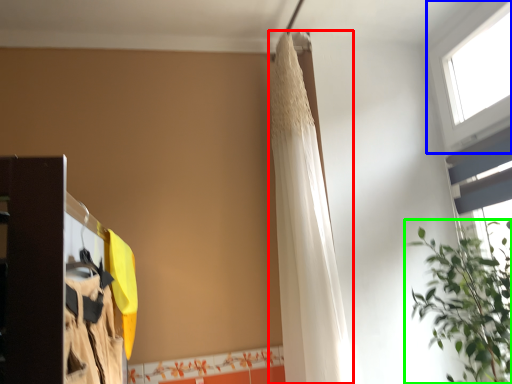
Question: Estimate the real-world distances between objects in this image. Which object is farther from shower curtain (highlighted by a red box), window (highlighted by a blue box) or houseplant (highlighted by a green box)?

Choices:
 (A) window
 (B) houseplant

Answer: (A)